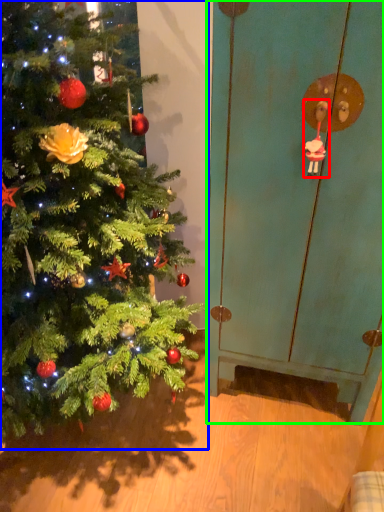
Question: Estimate the real-world distances between objects in this image. Which object is closer to toy (highlighted by a red box), christmas tree (highlighted by a blue box) or screen door (highlighted by a green box)?

Choices:
 (A) christmas tree
 (B) screen door

Answer: (B)